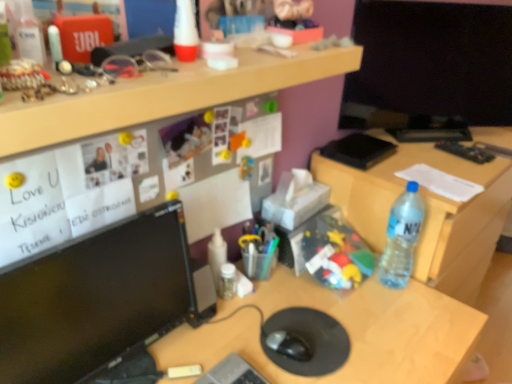
Locate an element on the screen. This screenshot has height=384, width=512. vacant space that is to the left of black rubber mousepad at center is located at coordinates (227, 334).